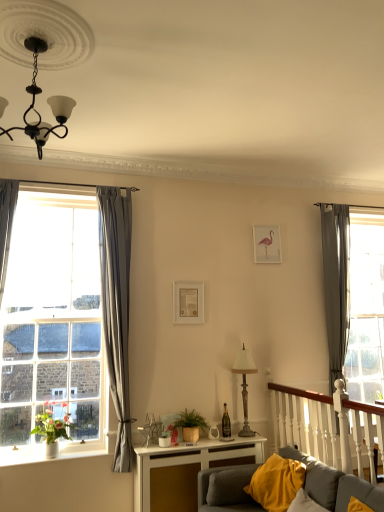
Where is `green woven basket at center`? This screenshot has width=384, height=512. green woven basket at center is located at coordinates (188, 425).

Identify the location of gray fabric curtain at right, positioned as the 1th curtain in back-to-front order. (336, 285).

What is the approximate width of gray fabric curtain at right, positioned as the 1th curtain in back-to-front order?

The width of gray fabric curtain at right, positioned as the 1th curtain in back-to-front order, is 6.01 inches.

The height and width of the screenshot is (512, 384). What do you see at coordinates (276, 483) in the screenshot?
I see `yellow fabric pillow at lower right` at bounding box center [276, 483].

Describe the element at coordinates (334, 484) in the screenshot. I see `soft gray fabric couch at lower right` at that location.

In order to face transparent glass door at right, should I rotate leftwards or rightwards?

It's best to rotate right around 22.638 degrees.

You are a GUI agent. You are given a task and a screenshot of the screen. Output one action in this format:
    pyautogui.click(x=<x>, y=<y>)
    Task: Click on the transparent glass door at right
    This screenshot has width=384, height=512.
    Given the screenshot: What is the action you would take?
    pyautogui.click(x=366, y=308)

What are the coordinates of `green woven basket at center` in the screenshot? It's located at (188, 425).

Would you say matte gold picture frame at center, the first picture frame from the front, is to the left or to the right of metallic lampshade at center-right in the picture?

matte gold picture frame at center, the first picture frame from the front, is positioned on metallic lampshade at center-right's left side.

Choose the correct answer: Is matte gold picture frame at center, arranged as the second picture frame when viewed from the back, inside metallic lampshade at center-right or outside it?

matte gold picture frame at center, arranged as the second picture frame when viewed from the back, is spatially situated outside metallic lampshade at center-right.

Does matte gold picture frame at center, arranged as the 1th picture frame when viewed from the left, have a smaller size compared to metallic lampshade at center-right?

Correct, matte gold picture frame at center, arranged as the 1th picture frame when viewed from the left, occupies less space than metallic lampshade at center-right.

From the image's perspective, is green woven basket at center under green matte plant at left?

Correct, green woven basket at center appears lower than green matte plant at left in the image.

Is green woven basket at center beside green matte plant at left?

They are not placed beside each other.

Is point (173, 439) less distant than point (64, 420)?

Yes, it is in front of point (64, 420).

From a real-world perspective, is green woven basket at center physically above green matte plant at left?

Actually, green woven basket at center is physically below green matte plant at left in the real world.

Based on the photo, how many degrees apart are the facing directions of white glossy table at lower center and green matte plant at left?

The facing directions of white glossy table at lower center and green matte plant at left are 0.719 degrees apart.

Considering the sizes of objects white glossy table at lower center and green matte plant at left in the image provided, who is bigger, white glossy table at lower center or green matte plant at left?

Bigger between the two is white glossy table at lower center.

Who is shorter, white glossy table at lower center or green matte plant at left?

green matte plant at left is shorter.

Which is correct: white glossy table at lower center is inside green matte plant at left, or outside of it?

The correct answer is: outside.

From the image's perspective, is soft gray fabric couch at lower right located above or below green woven basket at center?

soft gray fabric couch at lower right is situated lower than green woven basket at center in the image.

Between point (353, 484) and point (197, 423), which one is positioned in front?

Positioned in front is point (353, 484).

Which object is further away from the camera taking this photo, soft gray fabric couch at lower right or green woven basket at center?

green woven basket at center is further away from the camera.

Is soft gray fabric couch at lower right not close to green woven basket at center?

No, soft gray fabric couch at lower right is not far away from green woven basket at center.

Does green matte plant at left turn towards pink paper picture frame at upper center, which is counted as the second picture frame, starting from the bottom?

No, green matte plant at left does not turn towards pink paper picture frame at upper center, which is counted as the second picture frame, starting from the bottom.

This screenshot has height=512, width=384. I want to click on plant on the left of pink paper picture frame at upper center, which is counted as the second picture frame, starting from the bottom, so click(52, 426).

Can you confirm if green matte plant at left is taller than pink paper picture frame at upper center, the 1th picture frame when ordered from right to left?

In fact, green matte plant at left may be shorter than pink paper picture frame at upper center, the 1th picture frame when ordered from right to left.

Based on their positions, is green matte plant at left located to the left or right of pink paper picture frame at upper center, the 1th picture frame when ordered from right to left?

Clearly, green matte plant at left is on the left of pink paper picture frame at upper center, the 1th picture frame when ordered from right to left, in the image.

Does green woven basket at center have a smaller size compared to clear glass window at left?

Yes, green woven basket at center is smaller than clear glass window at left.

Is green woven basket at center aimed at clear glass window at left?

No, green woven basket at center is not oriented towards clear glass window at left.

Which object is thinner, green woven basket at center or clear glass window at left?

clear glass window at left is thinner.

From the image's perspective, between green woven basket at center and clear glass window at left, who is located below?

green woven basket at center appears lower in the image.

Consider the image. In terms of size, does soft gray fabric couch at lower right appear bigger or smaller than yellow fabric pillow at lower right?

In the image, soft gray fabric couch at lower right appears to be larger than yellow fabric pillow at lower right.

Looking at this image, considering their positions, is soft gray fabric couch at lower right located in front of or behind yellow fabric pillow at lower right?

In the image, soft gray fabric couch at lower right appears in front of yellow fabric pillow at lower right.

Considering the sizes of objects soft gray fabric couch at lower right and yellow fabric pillow at lower right in the image provided, who is shorter, soft gray fabric couch at lower right or yellow fabric pillow at lower right?

Standing shorter between the two is yellow fabric pillow at lower right.

Considering the positions of points (255, 502) and (267, 490), is point (255, 502) closer to camera compared to point (267, 490)?

That is False.

Locate an element on the screen. picture frame on the left of metallic lampshade at center-right is located at coordinates (188, 302).

Find the location of a particular element. This screenshot has width=384, height=512. plant that is above the green woven basket at center (from a real-world perspective) is located at coordinates (52, 426).

Based on their spatial positions, is green matte plant at left or green woven basket at center further from metallic lampshade at center-right?

green matte plant at left.

Based on their spatial positions, is matte gold picture frame at center, the first picture frame from the front, or green woven basket at center closer to gray fabric curtain at left, the first curtain viewed from the left?

The object closer to gray fabric curtain at left, the first curtain viewed from the left, is matte gold picture frame at center, the first picture frame from the front.

Looking at the image, which one is located further to white ceramic vase at lower left, green woven basket at center or matte gold picture frame at center, which ranks as the second picture frame in top-to-bottom order?

matte gold picture frame at center, which ranks as the second picture frame in top-to-bottom order.

Looking at the image, which one is located closer to white ceramic vase at lower left, metallic lampshade at center-right or transparent glass door at right?

The object closer to white ceramic vase at lower left is metallic lampshade at center-right.

From the image, which object appears to be farther from clear glass window at left, transparent glass door at right or green woven basket at center?

Among the two, transparent glass door at right is located further to clear glass window at left.

Considering their positions, is transparent glass door at right positioned closer to black matte chandelier at upper left than green matte plant at left?

green matte plant at left is closer to black matte chandelier at upper left.

Based on their spatial positions, is white wooden balustrade at right or metallic lampshade at center-right further from black matte chandelier at upper left?

white wooden balustrade at right is positioned further to the anchor black matte chandelier at upper left.

Which object lies further to the anchor point transparent glass door at right, soft gray fabric couch at lower right or black matte chandelier at upper left?

Among the two, black matte chandelier at upper left is located further to transparent glass door at right.

At what (x,y) coordinates should I click in order to perform the action: click on picture frame located between white wooden balustrade at right and pink paper picture frame at upper center, the 1th picture frame when ordered from right to left, in the depth direction. Please return your answer as a coordinate pair (x, y). Image resolution: width=384 pixels, height=512 pixels. Looking at the image, I should click on 188,302.

You are a GUI agent. You are given a task and a screenshot of the screen. Output one action in this format:
    pyautogui.click(x=<x>, y=<y>)
    Task: Click on the plant between soft gray fabric couch at lower right and matte gold picture frame at center, arranged as the second picture frame when viewed from the back, in the front-back direction
    The height and width of the screenshot is (512, 384).
    Given the screenshot: What is the action you would take?
    pyautogui.click(x=52, y=426)

The height and width of the screenshot is (512, 384). In order to click on studio couch between white ceramic vase at lower left and gray fabric curtain at right, which is the second curtain in left-to-right order, from left to right in this screenshot , I will do `click(334, 484)`.

Identify the location of picture frame between pink paper picture frame at upper center, which is counted as the 2th picture frame, starting from the front, and green woven basket at center, in the vertical direction. This screenshot has height=512, width=384. (188, 302).